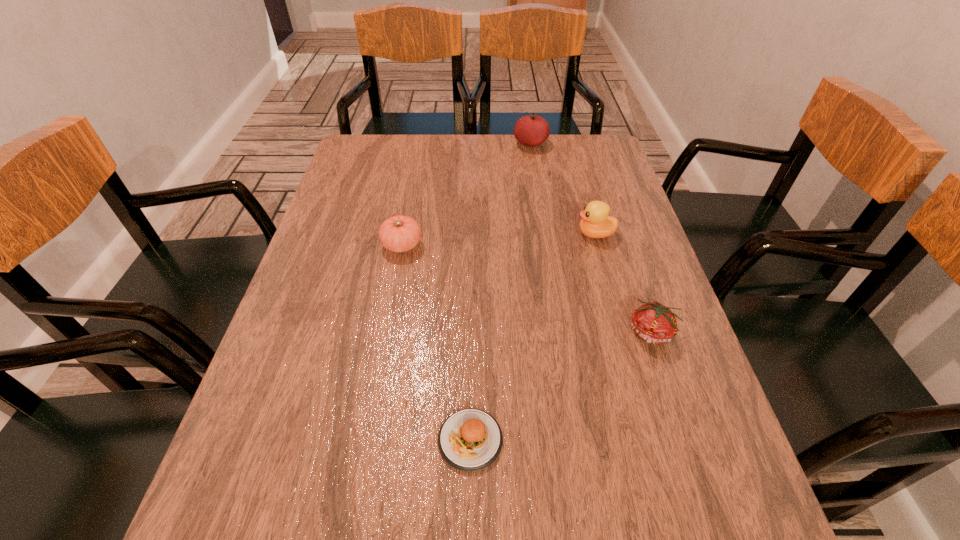
Where is `free space located on the face of the duckling`? The width and height of the screenshot is (960, 540). free space located on the face of the duckling is located at coordinates (468, 234).

Locate an element on the screen. The image size is (960, 540). vacant area situated 0.050m on the face of the duckling is located at coordinates (557, 234).

Identify the location of free spot located on the face of the duckling. The image size is (960, 540). (461, 234).

Identify the location of vacant space located on the back of the leftmost tomato. (408, 213).

Find the location of a particular element. The height and width of the screenshot is (540, 960). vacant region located 0.320m on the back of the nearest tomato is located at coordinates pyautogui.click(x=614, y=222).

You are a GUI agent. You are given a task and a screenshot of the screen. Output one action in this format:
    pyautogui.click(x=<x>, y=<y>)
    Task: Click on the free location located 0.270m on the back of the food
    The image size is (960, 540).
    Given the screenshot: What is the action you would take?
    pyautogui.click(x=472, y=299)

Locate an element on the screen. object present at the far edge is located at coordinates (532, 130).

Where is `duckling that is at the right edge`? duckling that is at the right edge is located at coordinates (595, 223).

Find the location of a particular element. The height and width of the screenshot is (540, 960). tomato that is at the right edge is located at coordinates (652, 322).

Where is `blank area at the far edge`? This screenshot has height=540, width=960. blank area at the far edge is located at coordinates click(x=487, y=144).